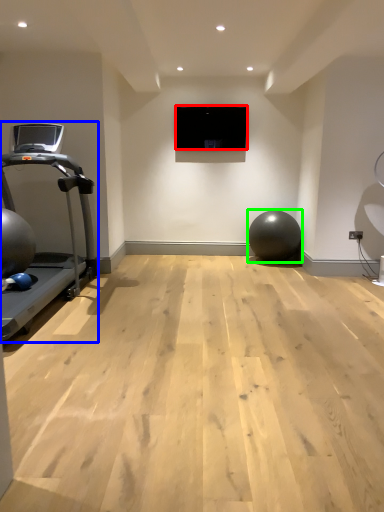
Question: Which object is positioned farthest from projection screen (highlighted by a red box)? Select from treadmill (highlighted by a blue box) and ball (highlighted by a green box).

Choices:
 (A) treadmill
 (B) ball

Answer: (A)